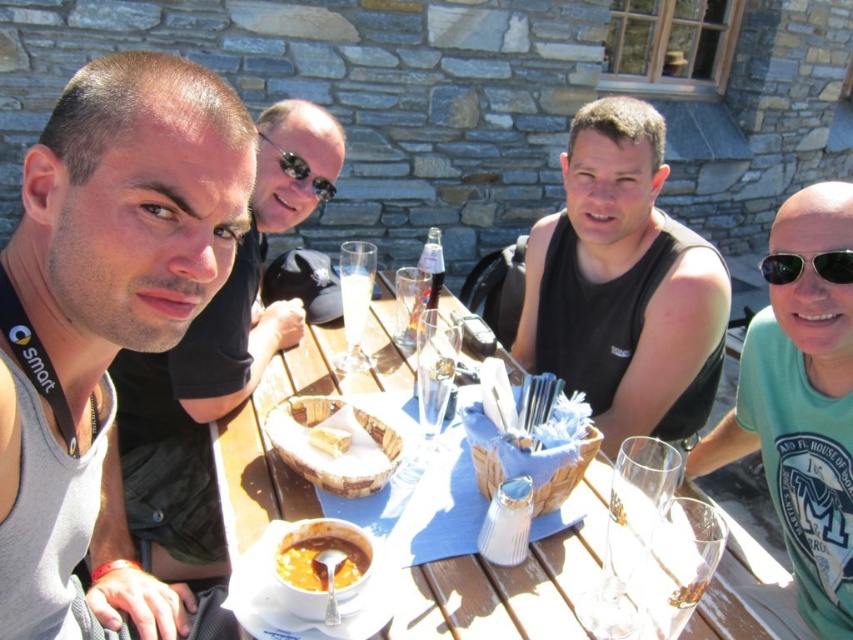
Who is more forward, (x=225, y=179) or (x=321, y=442)?

Point (x=225, y=179) is more forward.

The height and width of the screenshot is (640, 853). In order to click on gray fabric tank top at left in this screenshot , I will do coord(102,308).

Between green cotton t-shirt at center and smooth orange soup at lower center, which one appears on the left side from the viewer's perspective?

From the viewer's perspective, smooth orange soup at lower center appears more on the left side.

This screenshot has width=853, height=640. What do you see at coordinates (801, 400) in the screenshot?
I see `green cotton t-shirt at center` at bounding box center [801, 400].

The height and width of the screenshot is (640, 853). I want to click on green cotton t-shirt at center, so click(801, 400).

Is white wooden bread basket at center above breadcrustybasket at center?

No.

Who is positioned more to the left, white wooden bread basket at center or breadcrustybasket at center?

Positioned to the left is breadcrustybasket at center.

Does point (339, 456) lie behind point (328, 449)?

That is True.

This screenshot has width=853, height=640. Find the location of `white wooden bread basket at center`. white wooden bread basket at center is located at coordinates (328, 452).